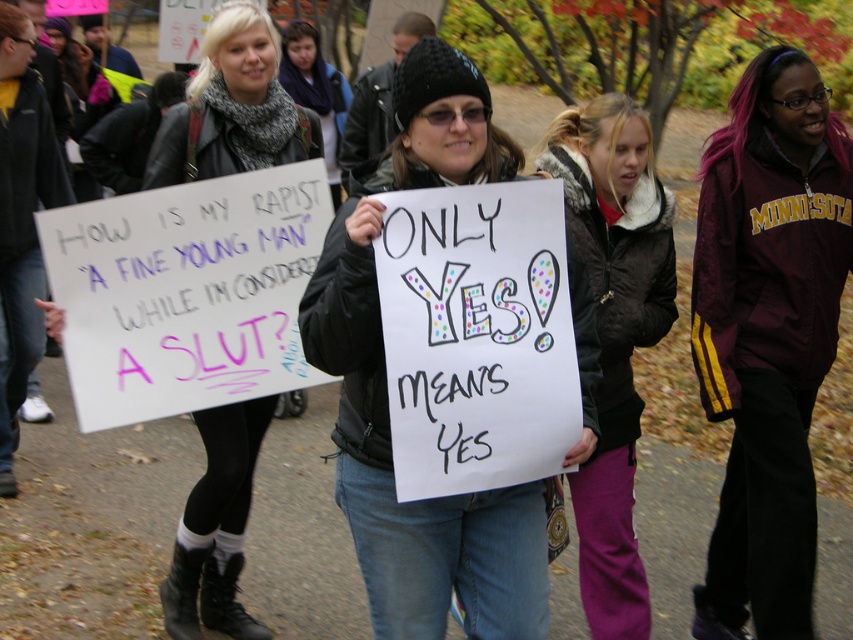
Who is more forward, (750,552) or (621,596)?

Point (621,596)

Is maroon windbreaker at center to the right of dark brown fur-lined jacket at center from the viewer's perspective?

Correct, you'll find maroon windbreaker at center to the right of dark brown fur-lined jacket at center.

Does point (700, 296) come farther from viewer compared to point (627, 172)?

Yes, point (700, 296) is farther from viewer.

Locate an element on the screen. maroon windbreaker at center is located at coordinates (769, 333).

Can you confirm if dark brown fur-lined jacket at center is smaller than knitted scarf at center?

Indeed, dark brown fur-lined jacket at center has a smaller size compared to knitted scarf at center.

Can you confirm if dark brown fur-lined jacket at center is wider than knitted scarf at center?

No.

What do you see at coordinates (614, 333) in the screenshot? I see `dark brown fur-lined jacket at center` at bounding box center [614, 333].

Locate an element on the screen. dark brown fur-lined jacket at center is located at coordinates (614, 333).

Based on the photo, is white paper sign at center thinner than knitted scarf at center?

Indeed, white paper sign at center has a lesser width compared to knitted scarf at center.

In the scene shown: Which of these two, white paper sign at center or knitted scarf at center, stands shorter?

Standing shorter between the two is white paper sign at center.

Does point (199, 596) come closer to viewer compared to point (337, 195)?

Yes, point (199, 596) is in front of point (337, 195).

Find the location of a particular element. white paper sign at center is located at coordinates (231, 108).